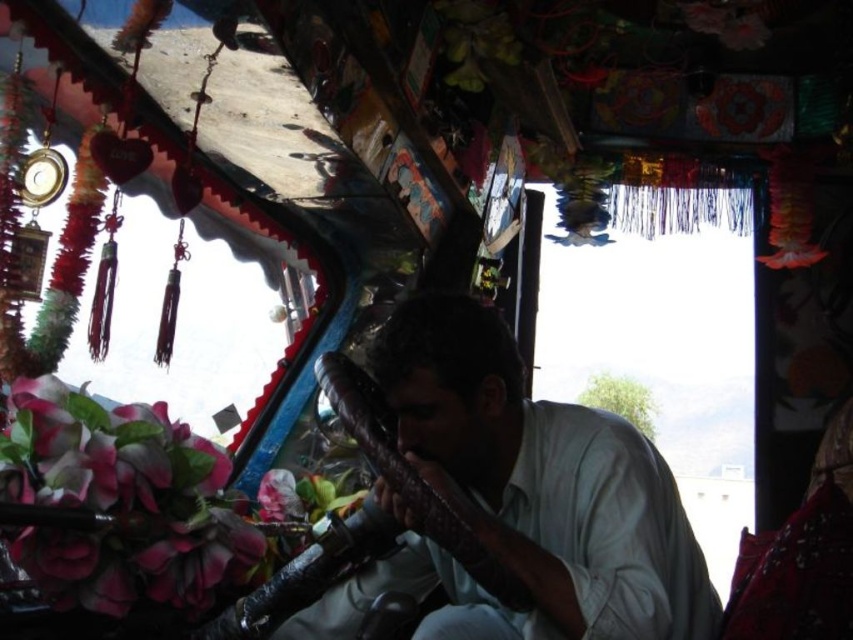
You are a passenger in the vehicle and want to reach both the matte brown instrument at center and the pink silk flower at lower left. Which object will you need to reach over first?

You will need to reach over the matte brown instrument at center first because it is closer to you than the pink silk flower at lower left, which is further away.

You are inside a decorated vehicle and need to place a small item on the tallest object. Which object should you choose between the matte brown instrument at center and the pink silk flower at lower left?

The matte brown instrument at center is much taller than the pink silk flower at lower left, so you should place the small item on the matte brown instrument at center.